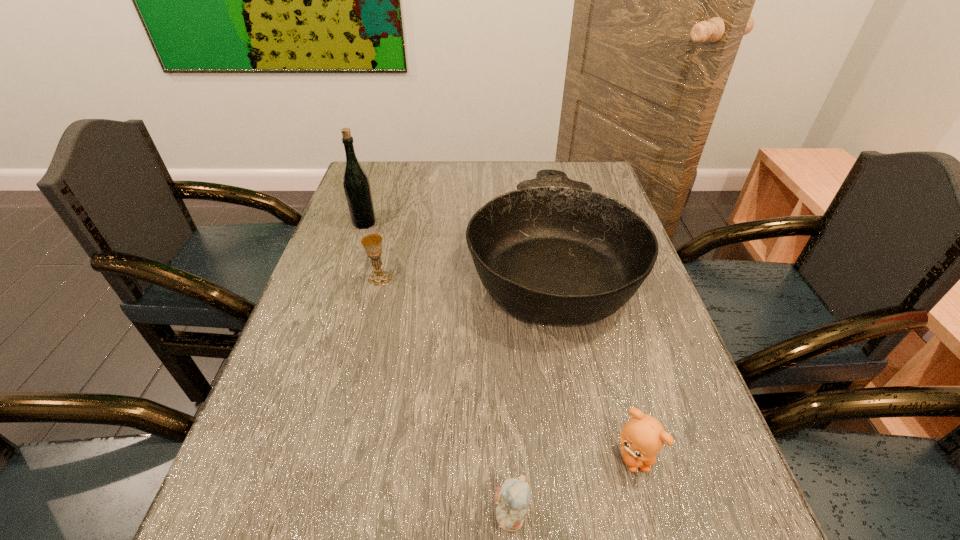
Find the location of a particular element. The height and width of the screenshot is (540, 960). the tallest object is located at coordinates (357, 189).

Identify the location of the fifth shortest object. (553, 251).

Image resolution: width=960 pixels, height=540 pixels. Identify the location of the third object from left to right. (372, 243).

You are a GUI agent. You are given a task and a screenshot of the screen. Output one action in this format:
    pyautogui.click(x=<x>, y=<y>)
    Task: Click on the farther teddy bear
    
    Given the screenshot: What is the action you would take?
    pyautogui.click(x=642, y=437)

Locate an element on the screen. the right teddy bear is located at coordinates (642, 437).

You are a GUI agent. You are given a task and a screenshot of the screen. Output one action in this format:
    pyautogui.click(x=<x>, y=<y>)
    Task: Click on the free space located on the back of the tallest object
    The height and width of the screenshot is (540, 960).
    Given the screenshot: What is the action you would take?
    pyautogui.click(x=375, y=190)

Locate an element on the screen. Image resolution: width=960 pixels, height=540 pixels. vacant space located with the handle extending from the side of the frying pan is located at coordinates (536, 183).

Image resolution: width=960 pixels, height=540 pixels. In order to click on blank space located 0.080m with the handle extending from the side of the frying pan in this screenshot , I will do `click(537, 186)`.

Identify the location of vacant point located 0.110m with the handle extending from the side of the frying pan. This screenshot has width=960, height=540. (536, 182).

Locate an element on the screen. The image size is (960, 540). vacant space located 0.190m on the right of the third object from left to right is located at coordinates (468, 279).